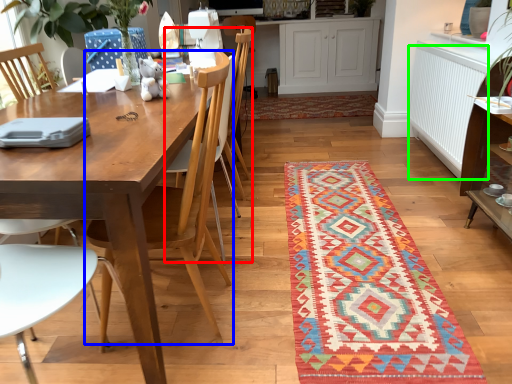
Question: Which object is the closest to the armchair (highlighted by a red box)? Choose among these: chair (highlighted by a blue box) or radiator (highlighted by a green box).

Choices:
 (A) chair
 (B) radiator

Answer: (A)